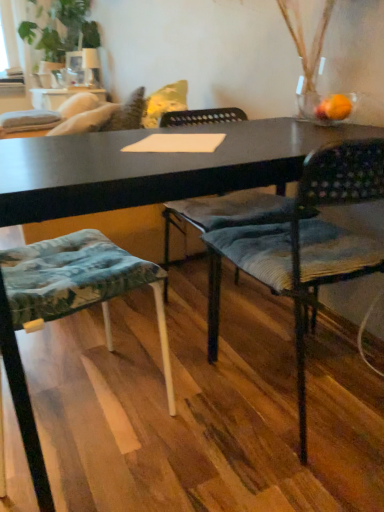
Describe the element at coordinates (79, 284) in the screenshot. This screenshot has width=384, height=512. I see `textured fabric cushion at lower left, the 2th chair viewed from the right` at that location.

This screenshot has width=384, height=512. In order to click on textured fabric chair at center, the 2th chair positioned from the left in this screenshot , I will do `click(307, 244)`.

In the image, is textured fabric cushion at lower left, which is the 1th chair from left to right, positioned in front of or behind textured fabric chair at center, placed as the first chair when sorted from right to left?

textured fabric cushion at lower left, which is the 1th chair from left to right, is in front of textured fabric chair at center, placed as the first chair when sorted from right to left.

Based on the photo, is textured fabric cushion at lower left, the 2th chair viewed from the right, thinner than textured fabric chair at center, the 2th chair positioned from the left?

Yes, textured fabric cushion at lower left, the 2th chair viewed from the right, is thinner than textured fabric chair at center, the 2th chair positioned from the left.

Is textured fabric cushion at lower left, which is the 1th chair from left to right, facing towards textured fabric chair at center, placed as the first chair when sorted from right to left?

Yes, textured fabric cushion at lower left, which is the 1th chair from left to right, faces towards textured fabric chair at center, placed as the first chair when sorted from right to left.

Which of these two, textured fabric cushion at lower left, which is the 1th chair from left to right, or textured fabric chair at center, the 2th chair positioned from the left, stands taller?

textured fabric cushion at lower left, which is the 1th chair from left to right, is taller.

Identify the location of plant located above the textured fabric chair at center, the 2th chair positioned from the left (from the image's perspective). (65, 30).

Between point (300, 444) and point (90, 28), which one is positioned behind?

The point (90, 28) is farther from the camera.

How many degrees apart are the facing directions of textured fabric chair at center, placed as the first chair when sorted from right to left, and green leafy plant at upper left?

They differ by 88.9 degrees in their facing directions.

In the image, is textured fabric chair at center, the 2th chair positioned from the left, on the left side or the right side of green leafy plant at upper left?

From the image, it's evident that textured fabric chair at center, the 2th chair positioned from the left, is to the right of green leafy plant at upper left.

Looking at this image, from a real-world perspective, is textured fabric chair at center, the 2th chair positioned from the left, physically located above or below textured fabric cushion at lower left, which is the 1th chair from left to right?

Clearly, from a real-world perspective, textured fabric chair at center, the 2th chair positioned from the left, is below textured fabric cushion at lower left, which is the 1th chair from left to right.

From the image's perspective, which object appears higher, textured fabric chair at center, the 2th chair positioned from the left, or textured fabric cushion at lower left, the 2th chair viewed from the right?

textured fabric chair at center, the 2th chair positioned from the left.

Consider the image. Considering their positions, is textured fabric chair at center, the 2th chair positioned from the left, located in front of or behind textured fabric cushion at lower left, which is the 1th chair from left to right?

In the image, textured fabric chair at center, the 2th chair positioned from the left, appears behind textured fabric cushion at lower left, which is the 1th chair from left to right.

Which is more to the left, textured fabric chair at center, the 2th chair positioned from the left, or textured fabric cushion at lower left, the 2th chair viewed from the right?

From the viewer's perspective, textured fabric cushion at lower left, the 2th chair viewed from the right, appears more on the left side.

Does green leafy plant at upper left turn towards textured fabric chair at center, placed as the first chair when sorted from right to left?

No, green leafy plant at upper left is not aimed at textured fabric chair at center, placed as the first chair when sorted from right to left.

Do you think green leafy plant at upper left is within textured fabric chair at center, placed as the first chair when sorted from right to left, or outside of it?

green leafy plant at upper left is not enclosed by textured fabric chair at center, placed as the first chair when sorted from right to left.

Who is taller, green leafy plant at upper left or textured fabric chair at center, the 2th chair positioned from the left?

green leafy plant at upper left.

Considering the sizes of objects green leafy plant at upper left and textured fabric cushion at lower left, which is the 1th chair from left to right, in the image provided, who is bigger, green leafy plant at upper left or textured fabric cushion at lower left, which is the 1th chair from left to right,?

green leafy plant at upper left.

Which chair is the 2nd one when counting from the front of the green leafy plant at upper left? Please provide its 2D coordinates.

[(79, 284)]

Considering the positions of point (77, 15) and point (167, 384), is point (77, 15) closer or farther from the camera than point (167, 384)?

Point (77, 15) is farther from the camera than point (167, 384).

Is textured fabric cushion at lower left, which is the 1th chair from left to right, in contact with green leafy plant at upper left?

There is a gap between textured fabric cushion at lower left, which is the 1th chair from left to right, and green leafy plant at upper left.

Is textured fabric cushion at lower left, which is the 1th chair from left to right, positioned with its back to green leafy plant at upper left?

No, green leafy plant at upper left is not at the back of textured fabric cushion at lower left, which is the 1th chair from left to right.

Can you confirm if textured fabric cushion at lower left, the 2th chair viewed from the right, is bigger than green leafy plant at upper left?

No.

Locate an element on the screen. The image size is (384, 512). chair that is on the right side of textured fabric cushion at lower left, the 2th chair viewed from the right is located at coordinates (307, 244).

You are a GUI agent. You are given a task and a screenshot of the screen. Output one action in this format:
    pyautogui.click(x=<x>, y=<y>)
    Task: Click on the plant on the left of textured fabric chair at center, placed as the first chair when sorted from right to left
    The width and height of the screenshot is (384, 512).
    Given the screenshot: What is the action you would take?
    pyautogui.click(x=65, y=30)

Considering their positions, is green leafy plant at upper left positioned further to textured fabric cushion at lower left, the 2th chair viewed from the right, than textured fabric chair at center, the 2th chair positioned from the left?

green leafy plant at upper left is positioned further to the anchor textured fabric cushion at lower left, the 2th chair viewed from the right.

Estimate the real-world distances between objects in this image. Which object is closer to green leafy plant at upper left, textured fabric chair at center, placed as the first chair when sorted from right to left, or textured fabric cushion at lower left, which is the 1th chair from left to right?

textured fabric cushion at lower left, which is the 1th chair from left to right, lies closer to green leafy plant at upper left than the other object.

When comparing their distances from textured fabric chair at center, placed as the first chair when sorted from right to left, does textured fabric cushion at lower left, the 2th chair viewed from the right, or green leafy plant at upper left seem closer?

Among the two, textured fabric cushion at lower left, the 2th chair viewed from the right, is located nearer to textured fabric chair at center, placed as the first chair when sorted from right to left.

Looking at the image, which one is located further to green leafy plant at upper left, textured fabric cushion at lower left, which is the 1th chair from left to right, or textured fabric chair at center, the 2th chair positioned from the left?

textured fabric chair at center, the 2th chair positioned from the left, is positioned further to the anchor green leafy plant at upper left.

When comparing their distances from textured fabric cushion at lower left, the 2th chair viewed from the right, does textured fabric chair at center, the 2th chair positioned from the left, or green leafy plant at upper left seem closer?

Based on the image, textured fabric chair at center, the 2th chair positioned from the left, appears to be nearer to textured fabric cushion at lower left, the 2th chair viewed from the right.

When comparing their distances from textured fabric chair at center, the 2th chair positioned from the left, does green leafy plant at upper left or textured fabric cushion at lower left, which is the 1th chair from left to right, seem further?

green leafy plant at upper left is positioned further to the anchor textured fabric chair at center, the 2th chair positioned from the left.

Locate an element on the screen. The height and width of the screenshot is (512, 384). chair between textured fabric cushion at lower left, the 2th chair viewed from the right, and green leafy plant at upper left in the front-back direction is located at coordinates [x=307, y=244].